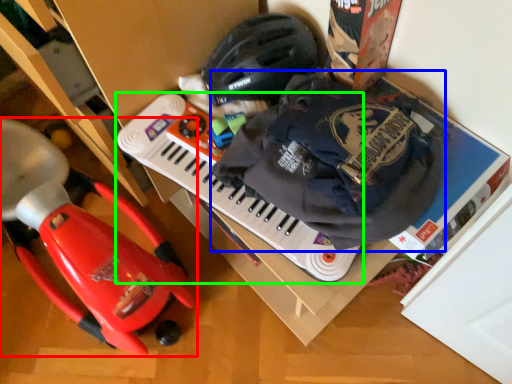
Question: Which object is positioned farthest from toy (highlighted by a red box)? Select from waste (highlighted by a blue box) and musical keyboard (highlighted by a green box).

Choices:
 (A) waste
 (B) musical keyboard

Answer: (A)